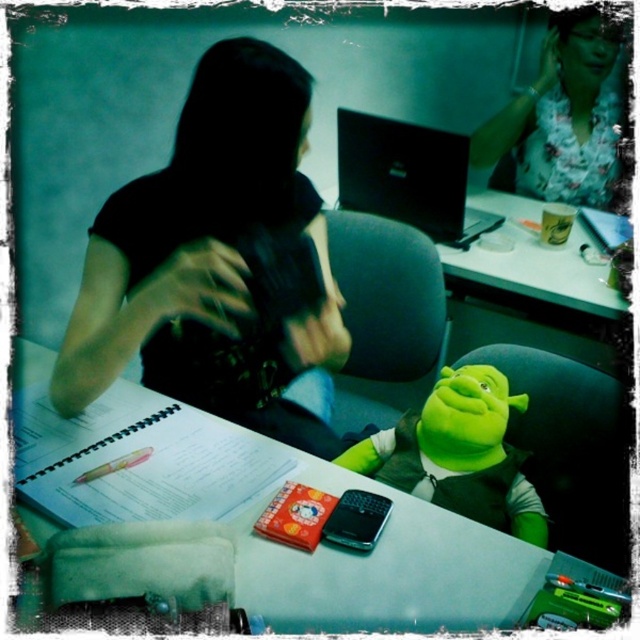
Between floral fabric shirt at upper right and black plastic phone at center, which one is positioned higher?

floral fabric shirt at upper right

Does point (605, 76) lie in front of point (378, 509)?

No, (605, 76) is behind (378, 509).

This screenshot has height=640, width=640. Identify the location of floral fabric shirt at upper right. (561, 116).

Between matte black hoodie at upper left and black glossy laptop at center, which one is positioned higher?

Positioned higher is black glossy laptop at center.

Does matte black hoodie at upper left lie in front of black glossy laptop at center?

Yes, matte black hoodie at upper left is closer to the viewer.

This screenshot has height=640, width=640. What do you see at coordinates (216, 260) in the screenshot? I see `matte black hoodie at upper left` at bounding box center [216, 260].

What are the coordinates of `matte black hoodie at upper left` in the screenshot? It's located at (216, 260).

Does matte black hoodie at upper left come in front of green plush toy at center?

Yes.

Who is more forward, (326, 436) or (454, 508)?

Point (454, 508) is in front.

Locate an element on the screen. matte black hoodie at upper left is located at coordinates (216, 260).